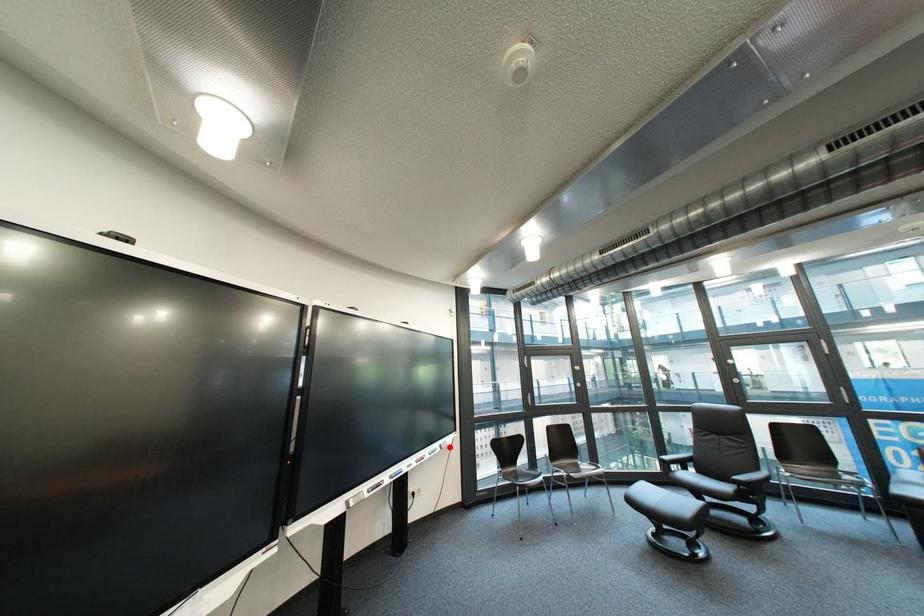
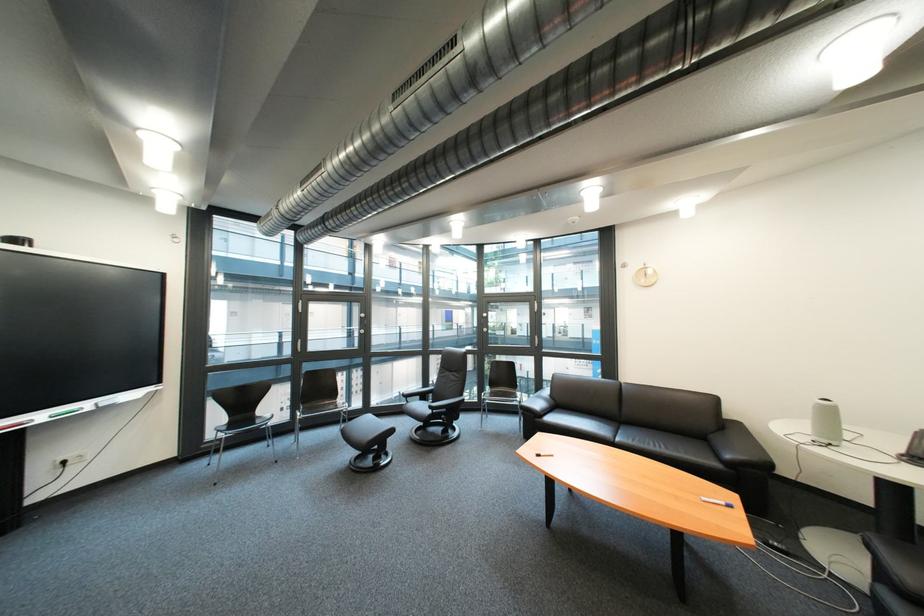
Question: A red point is marked in image1. In image2, is the corresponding 3D point closer to the camera or farther? Reply with the corresponding letter.

Choices:
 (A) The corresponding 3D point is closer.
 (B) The corresponding 3D point is farther.

Answer: (A)